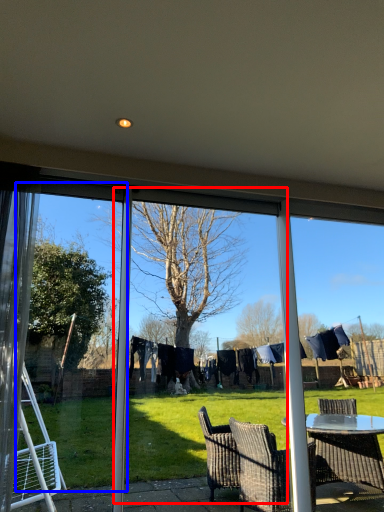
Question: Which point is further to the camera, screen door (highlighted by a red box) or screen door (highlighted by a blue box)?

Choices:
 (A) screen door
 (B) screen door

Answer: (A)